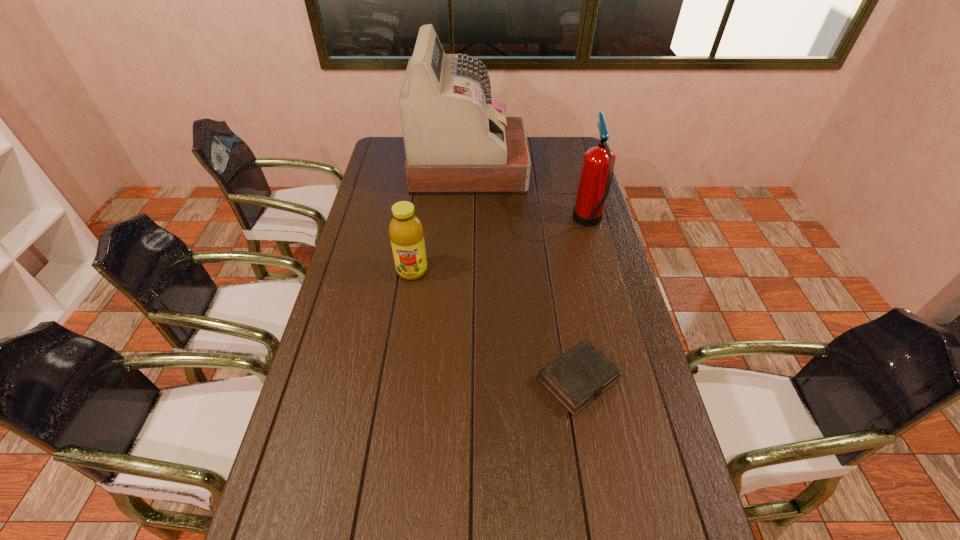
The height and width of the screenshot is (540, 960). I want to click on cash register, so click(457, 141).

You are a GUI agent. You are given a task and a screenshot of the screen. Output one action in this format:
    pyautogui.click(x=<x>, y=<y>)
    Task: Click on the tallest object
    
    Given the screenshot: What is the action you would take?
    pyautogui.click(x=457, y=141)

Where is `fire extinguisher`? fire extinguisher is located at coordinates (597, 170).

Where is `the third shortest object`? the third shortest object is located at coordinates (597, 170).

Find the location of a particular element. The width and height of the screenshot is (960, 540). the second shortest object is located at coordinates (406, 232).

In order to click on the third farthest object in this screenshot , I will do `click(406, 232)`.

This screenshot has height=540, width=960. In order to click on book in this screenshot , I will do `click(579, 376)`.

The width and height of the screenshot is (960, 540). Identify the location of the shortest object. (579, 376).

This screenshot has height=540, width=960. Identify the location of blank space located on the operating side of the tallest object. [582, 167].

Locate an element on the screen. vacant position located on the back of the fire extinguisher is located at coordinates (578, 183).